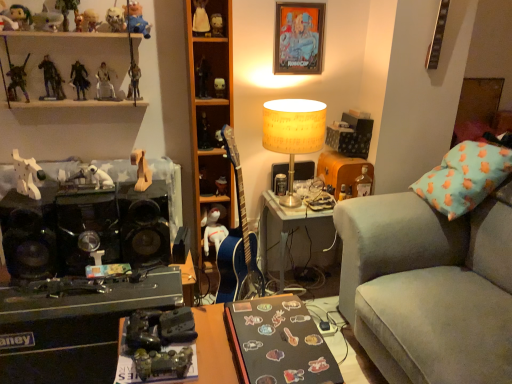
Where is `vacant space to the left of translucent glass bottle at right`? The width and height of the screenshot is (512, 384). vacant space to the left of translucent glass bottle at right is located at coordinates (323, 200).